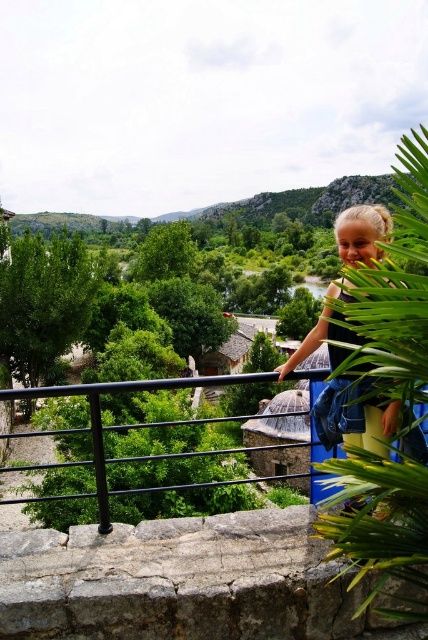
Does green leafy plant at upper right have a lesser height compared to blonde hair at upper right?

In fact, green leafy plant at upper right may be taller than blonde hair at upper right.

Is green leafy plant at upper right below blonde hair at upper right?

No.

The width and height of the screenshot is (428, 640). What do you see at coordinates (154, 300) in the screenshot?
I see `green leafy plant at upper right` at bounding box center [154, 300].

The height and width of the screenshot is (640, 428). Identify the location of green leafy plant at upper right. (154, 300).

Which is below, rusty stone ledge at lower center or black metal/rail at left?

black metal/rail at left

Who is more forward, (249, 620) or (214, 381)?

Positioned in front is point (249, 620).

Locate an element on the screen. This screenshot has width=428, height=640. rusty stone ledge at lower center is located at coordinates (180, 580).

Consider the image. Between blonde hair at upper right and black metal/rail at left, which one is positioned higher?

blonde hair at upper right is higher up.

Measure the distance between point (x=379, y=216) and camera.

Point (x=379, y=216) is 9.19 meters from camera.

Locate an element on the screen. The width and height of the screenshot is (428, 640). blonde hair at upper right is located at coordinates (353, 416).

Identify the location of blonde hair at upper right. (353, 416).